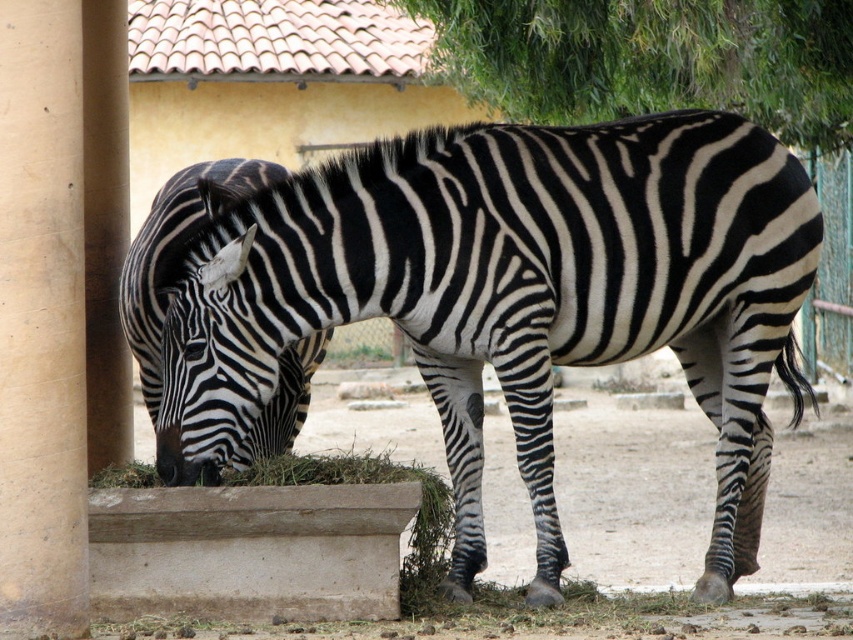
Between green leafy tree at upper center and black and white striped zebra at lower left, which one appears on the left side from the viewer's perspective?

From the viewer's perspective, black and white striped zebra at lower left appears more on the left side.

Between green leafy tree at upper center and black and white striped zebra at lower left, which one has more height?

With more height is black and white striped zebra at lower left.

At what (x,y) coordinates should I click in order to perform the action: click on green leafy tree at upper center. Please return your answer as a coordinate pair (x, y). Looking at the image, I should click on pos(653,60).

Can you confirm if black and white striped zebra at center is positioned to the left of black and white striped zebra at lower left?

Incorrect, black and white striped zebra at center is not on the left side of black and white striped zebra at lower left.

What do you see at coordinates (514, 296) in the screenshot?
I see `black and white striped zebra at center` at bounding box center [514, 296].

Does point (657, 147) come farther from viewer compared to point (154, 392)?

No, it is in front of (154, 392).

In order to click on black and white striped zebra at center in this screenshot , I will do `click(514, 296)`.

Which is in front, point (494, 150) or point (659, 20)?

Point (494, 150) is in front.

What do you see at coordinates (514, 296) in the screenshot? Image resolution: width=853 pixels, height=640 pixels. I see `black and white striped zebra at center` at bounding box center [514, 296].

The height and width of the screenshot is (640, 853). I want to click on black and white striped zebra at center, so click(514, 296).

Identify the location of black and white striped zebra at center. (514, 296).